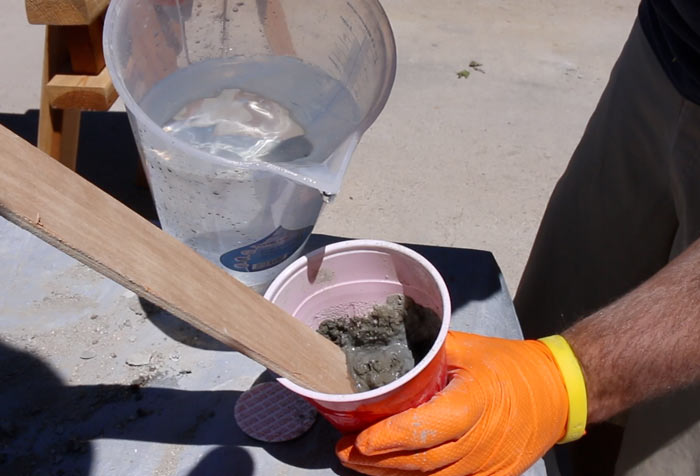
Where is `water jug`? The height and width of the screenshot is (476, 700). water jug is located at coordinates (355, 60).